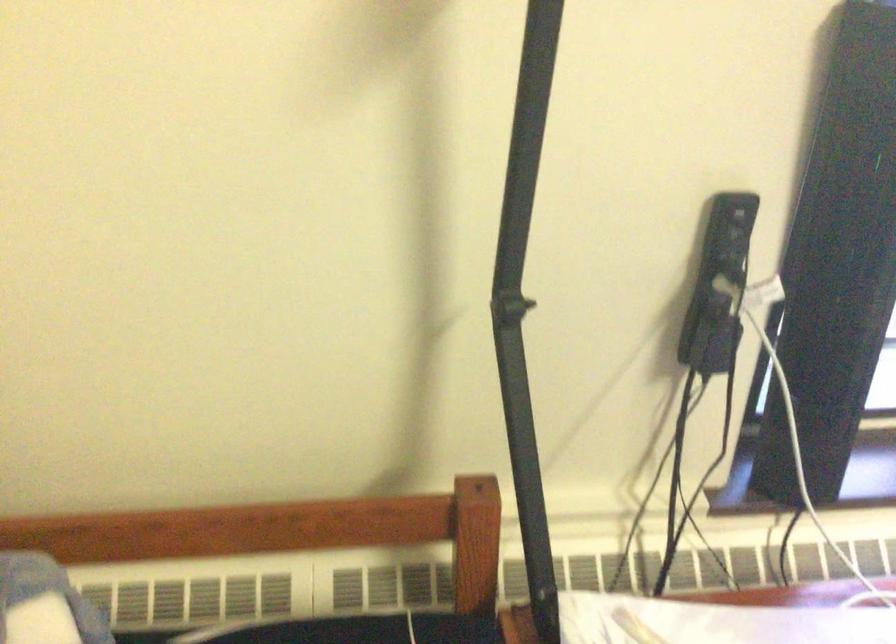
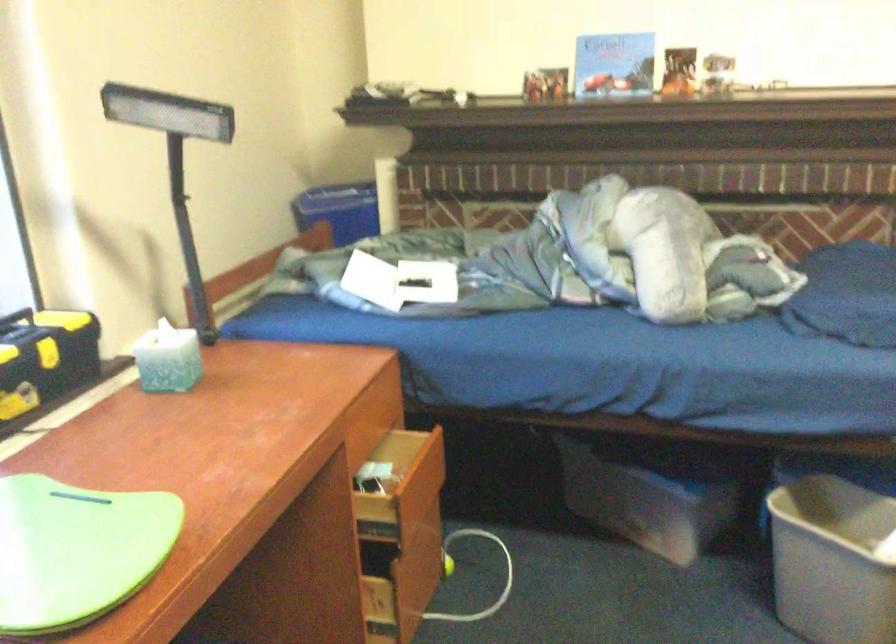
Question: The images are taken continuously from a first-person perspective. In which direction is your viewpoint rotating?

Choices:
 (A) Left
 (B) Right
 (C) Up
 (D) Down

Answer: (B)